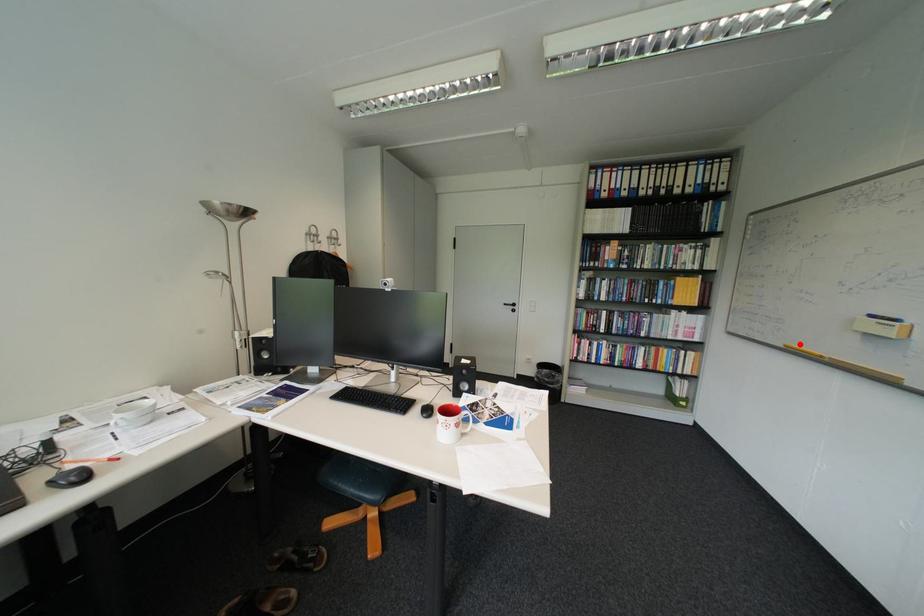
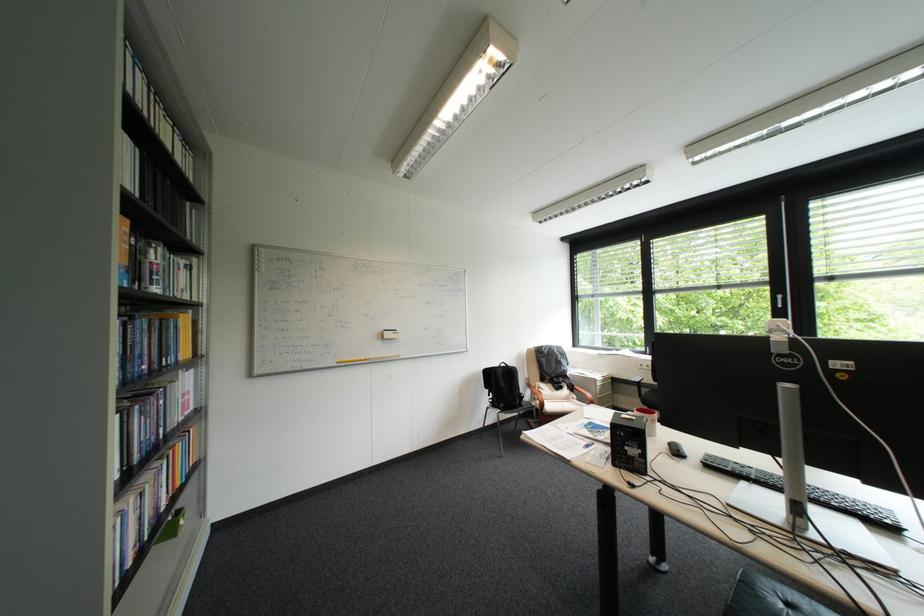
Find the pixel in the second image that matches the highlighted location in the first image.

(350, 361)